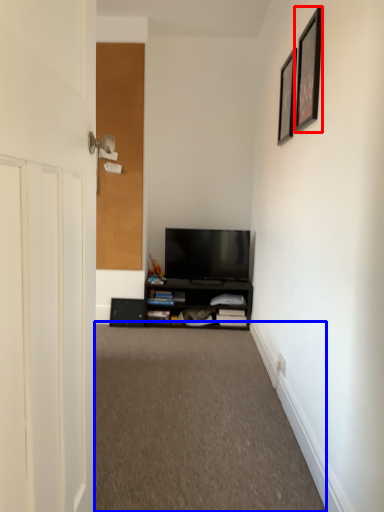
Question: Which object appears farthest to the camera in this image, picture frame (highlighted by a red box) or plain (highlighted by a blue box)?

Choices:
 (A) picture frame
 (B) plain

Answer: (A)